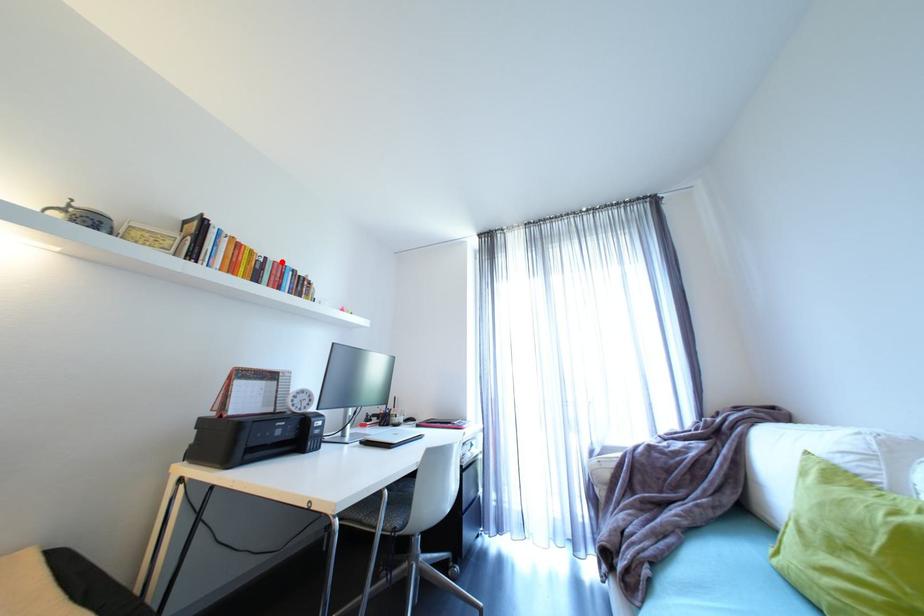
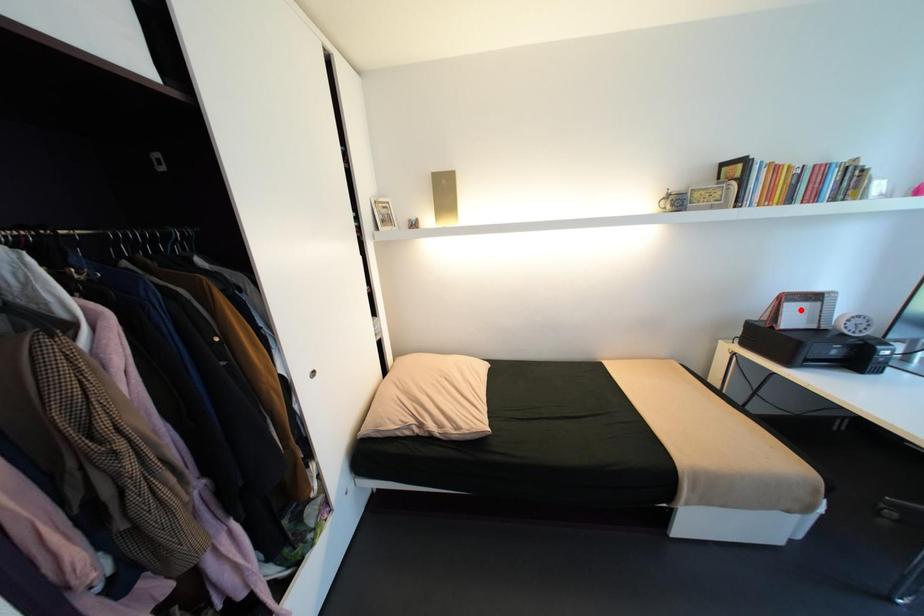
I am providing you with two images of the same scene from different viewpoints. A red point is marked on the first image and another point is marked on the second image. Is the red point in image1 aligned with the point shown in image2?

No